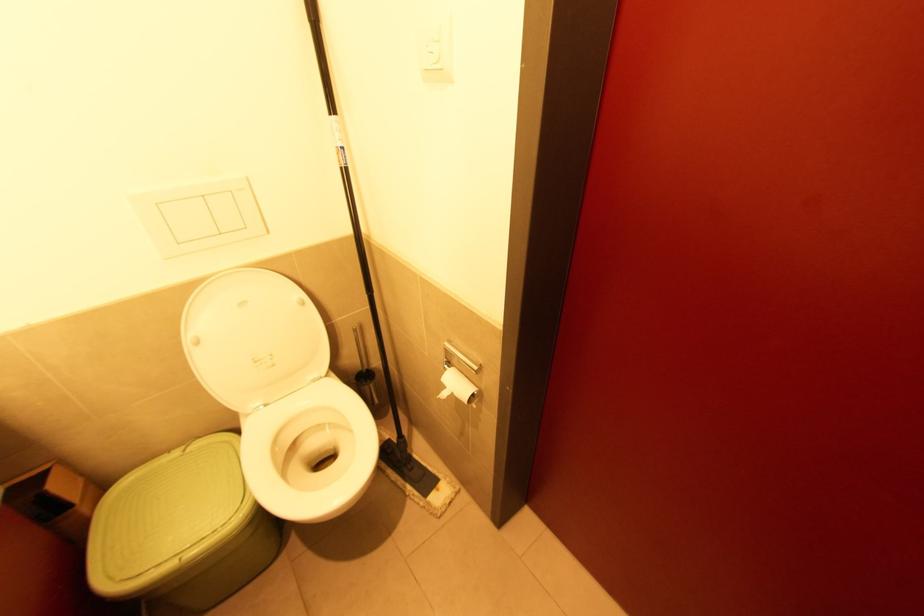
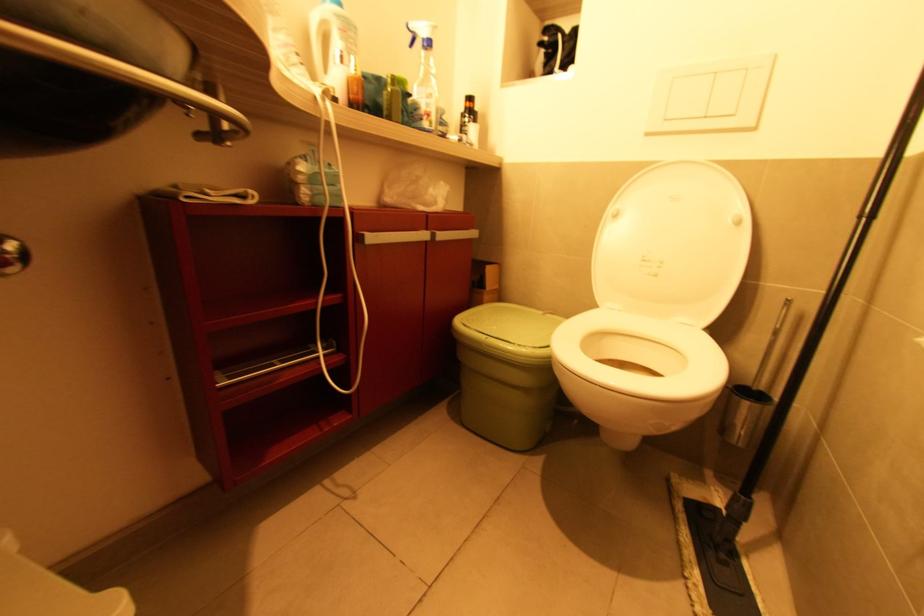
Question: The images are taken continuously from a first-person perspective. In which direction is your viewpoint rotating?

Choices:
 (A) Left
 (B) Right
 (C) Up
 (D) Down

Answer: (A)